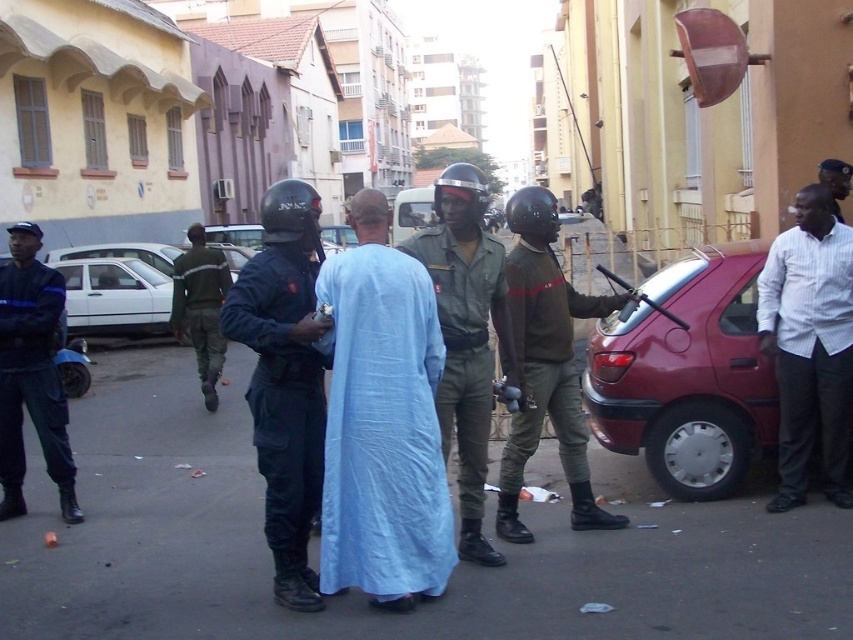
Looking at this image, you are a pedestrian on the street and want to cross to the other side. You see a white striped shirt at right and a green uniform at center. Which direction should you walk to avoid both?

To avoid both the white striped shirt at right and the green uniform at center, you should walk to the left since the white striped shirt at right is to the right of the green uniform at center, meaning both are positioned to your right and center. Moving left would take you away from both.